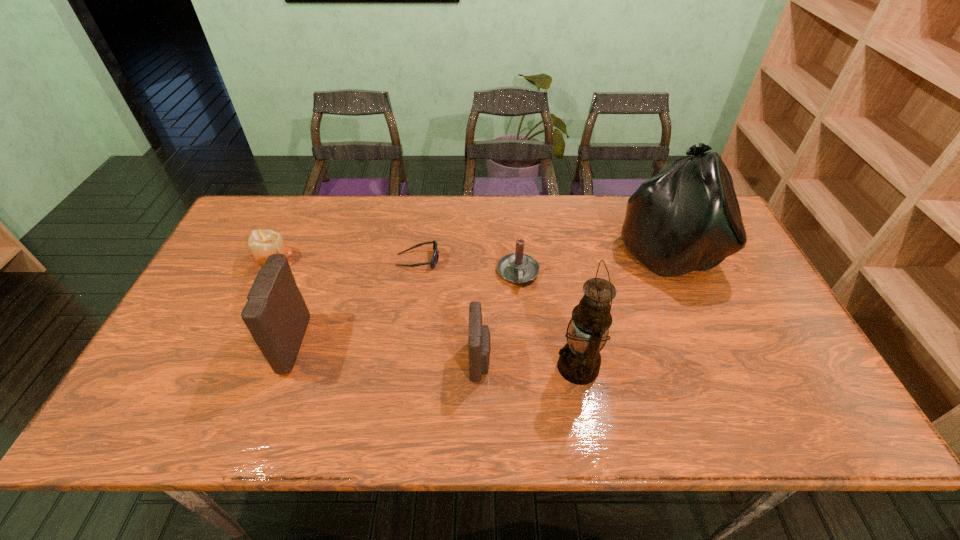
The image size is (960, 540). Identify the location of the taller pouch. (276, 314).

Identify the location of the second object from left to right. (276, 314).

Locate an element on the screen. the fourth shortest object is located at coordinates pos(479,338).

The width and height of the screenshot is (960, 540). What are the coordinates of `the fourth object from left to right` in the screenshot? It's located at (479, 338).

The height and width of the screenshot is (540, 960). Identify the location of the fifth object from right to left. (435, 257).

Locate an element on the screen. the shortest object is located at coordinates coord(435,257).

Locate an element on the screen. the rightmost object is located at coordinates (686, 218).

I want to click on the right candle, so click(x=518, y=268).

You are a GUI agent. You are given a task and a screenshot of the screen. Output one action in this format:
    pyautogui.click(x=<x>, y=<y>)
    Task: Click on the left candle
    This screenshot has height=540, width=960.
    Given the screenshot: What is the action you would take?
    pyautogui.click(x=262, y=242)

This screenshot has height=540, width=960. I want to click on oil lamp, so click(x=579, y=362).